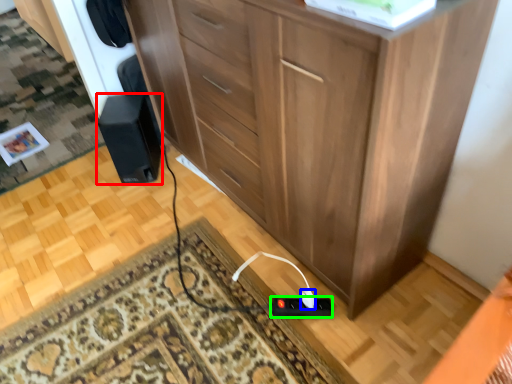
Question: Based on their relative distances, which object is nearer to speaker (highlighted by a red box)? Choose from plug (highlighted by a blue box) and plug (highlighted by a green box).

Choices:
 (A) plug
 (B) plug

Answer: (B)